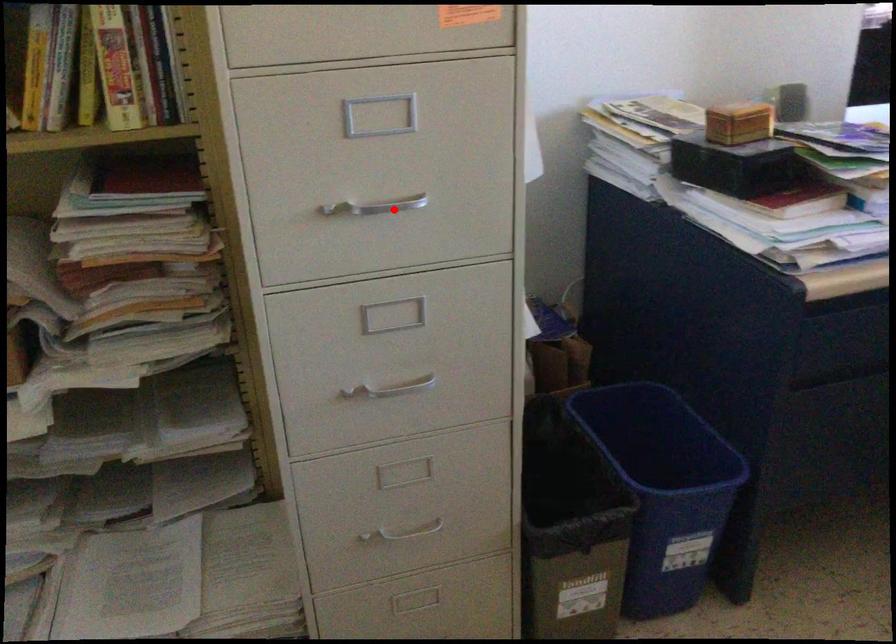
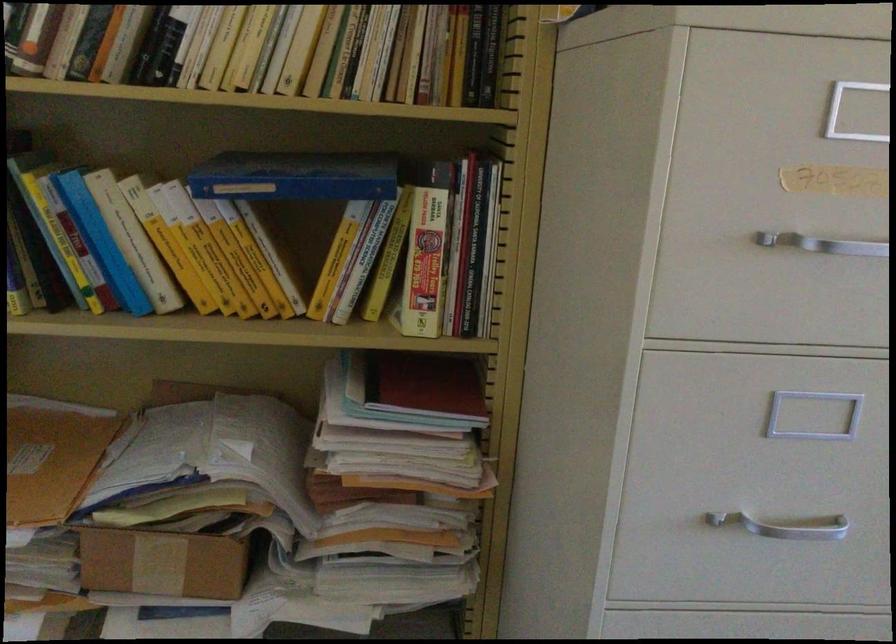
The point at the highlighted location is marked in the first image. Where is the corresponding point in the second image?

(784, 526)